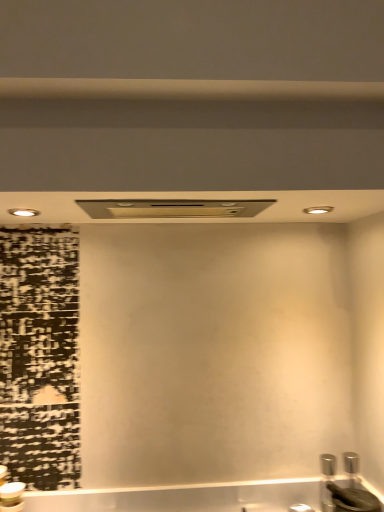
Question: From a real-world perspective, does satin nickel exhaust hood at center sit lower than black matte sink at lower right?

Choices:
 (A) yes
 (B) no

Answer: (B)

Question: From the image's perspective, is satin nickel exhaust hood at center below black matte sink at lower right?

Choices:
 (A) yes
 (B) no

Answer: (B)

Question: Does satin nickel exhaust hood at center have a lesser height compared to black matte sink at lower right?

Choices:
 (A) yes
 (B) no

Answer: (A)

Question: Considering the relative positions of satin nickel exhaust hood at center and black matte sink at lower right in the image provided, is satin nickel exhaust hood at center to the right of black matte sink at lower right from the viewer's perspective?

Choices:
 (A) no
 (B) yes

Answer: (A)

Question: Is the position of satin nickel exhaust hood at center more distant than that of black matte sink at lower right?

Choices:
 (A) no
 (B) yes

Answer: (A)

Question: Is satin nickel exhaust hood at center facing away from black matte sink at lower right?

Choices:
 (A) yes
 (B) no

Answer: (B)

Question: Is beige matte beam at upper center positioned behind black matte sink at lower right?

Choices:
 (A) no
 (B) yes

Answer: (A)

Question: Considering the relative sizes of beige matte beam at upper center and black matte sink at lower right in the image provided, is beige matte beam at upper center smaller than black matte sink at lower right?

Choices:
 (A) no
 (B) yes

Answer: (A)

Question: Is beige matte beam at upper center completely or partially outside of black matte sink at lower right?

Choices:
 (A) no
 (B) yes

Answer: (B)

Question: Is beige matte beam at upper center at the right side of black matte sink at lower right?

Choices:
 (A) no
 (B) yes

Answer: (A)

Question: Is beige matte beam at upper center taller than black matte sink at lower right?

Choices:
 (A) no
 (B) yes

Answer: (A)

Question: Is beige matte beam at upper center aimed at black matte sink at lower right?

Choices:
 (A) yes
 (B) no

Answer: (B)

Question: Considering the relative positions of satin nickel exhaust hood at center and beige matte beam at upper center in the image provided, is satin nickel exhaust hood at center behind beige matte beam at upper center?

Choices:
 (A) no
 (B) yes

Answer: (B)